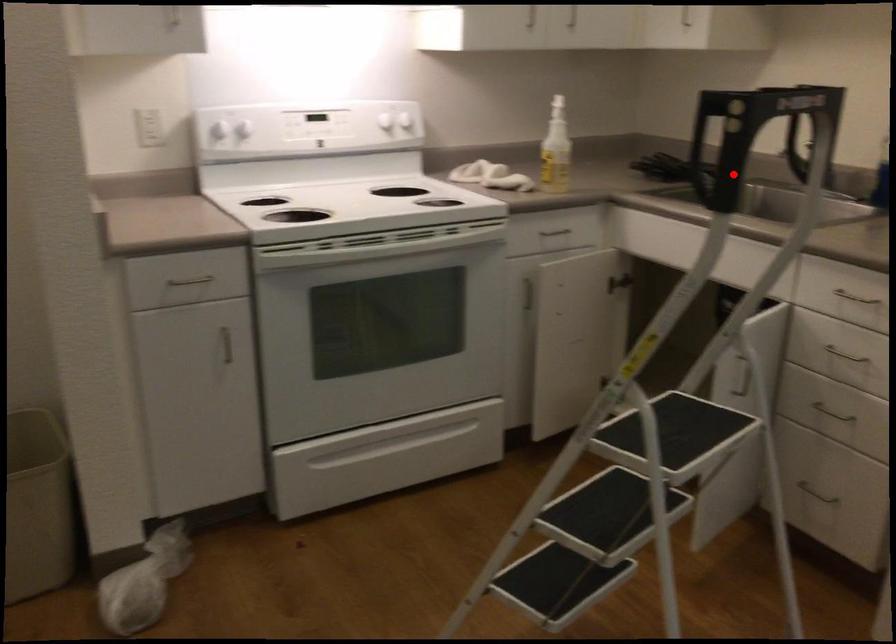
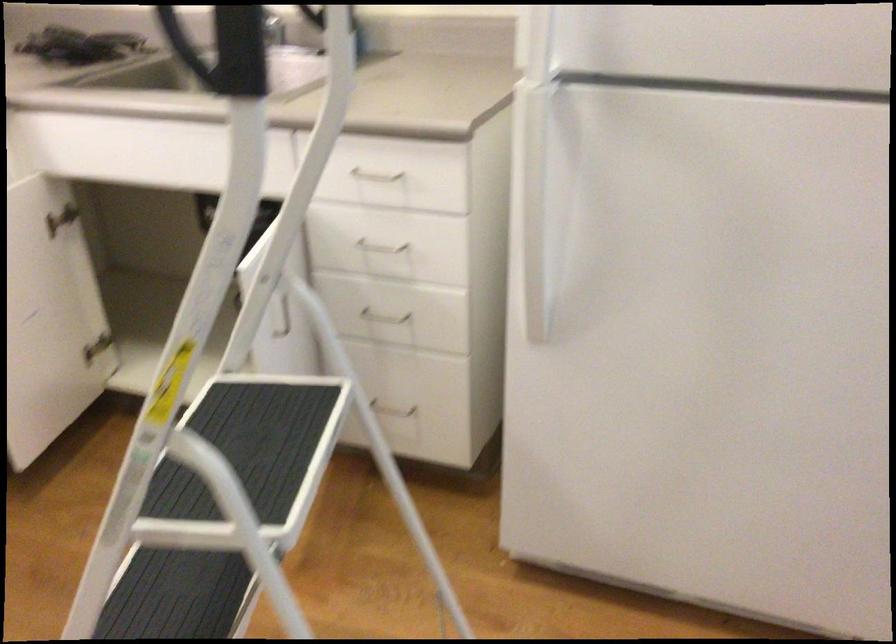
The point at the highlighted location is marked in the first image. Where is the corresponding point in the second image?

(186, 49)